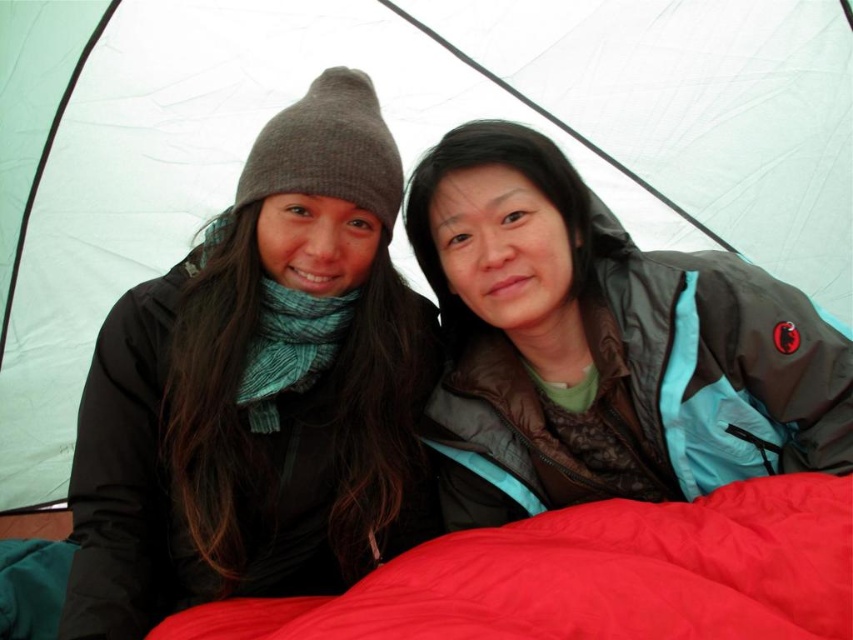
You are standing inside the tent and want to place a small gift between the two points marked as point (149, 355) and point (561, 570). Since the gift needs to be placed closer to the viewer, which point should you use as the reference for placement?

Point (149, 355) is further to the viewer than point (561, 570), so you should use point (149, 355) as the reference for placing the gift closer to the viewer.

You are trying to determine the order of the jackets from left to right. Given that you see both the matte black jacket at left and the matte blue jacket at center, which one is positioned further to the left?

The matte black jacket at left is positioned further to the left than the matte blue jacket at center.

You are standing outside the tent and want to locate the matte black jacket at left. Based on its 2D coordinates, where should you look relative to the center of the tent?

The matte black jacket at left is located at 2D coordinates point (260, 388), which is to the right and slightly below the center of the tent.